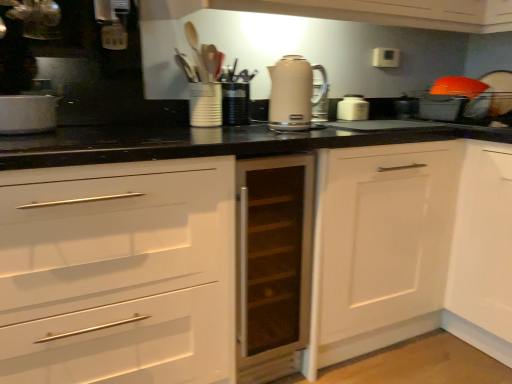
Identify the location of space that is in front of beige glossy electric kettle at center, arranged as the second kitchen appliance when viewed from the left. (323, 127).